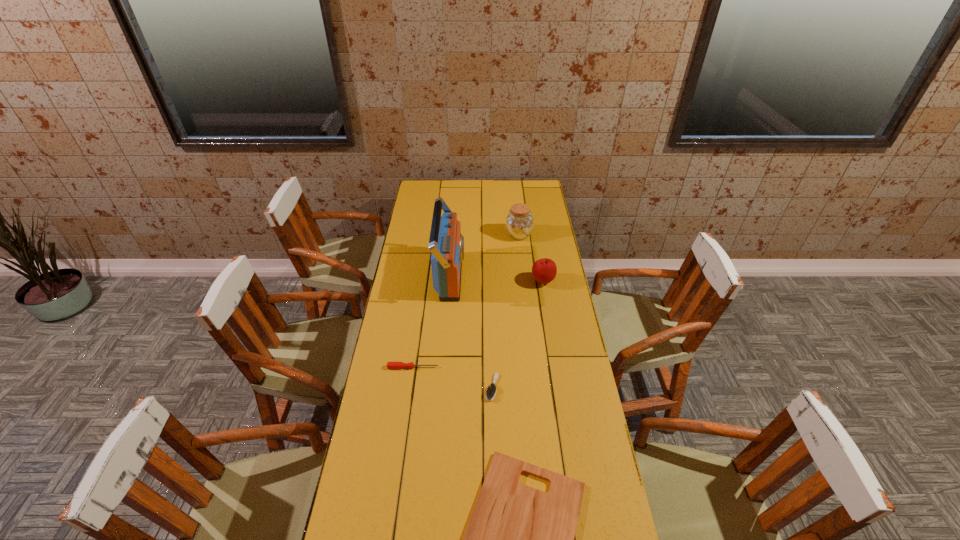
Image resolution: width=960 pixels, height=540 pixels. Identify the location of free point located 0.150m on the right of the scrubbing brush. [x=542, y=387].

Locate an element on the screen. Image resolution: width=960 pixels, height=540 pixels. object that is positioned at the left edge is located at coordinates (390, 365).

Find the location of a particular element. jar at the right edge is located at coordinates (519, 223).

The width and height of the screenshot is (960, 540). Find the location of `apple that is at the right edge`. apple that is at the right edge is located at coordinates (544, 270).

This screenshot has height=540, width=960. I want to click on free space at the far edge of the desktop, so 482,183.

The width and height of the screenshot is (960, 540). In order to click on vacant area at the left edge in this screenshot , I will do `click(420, 337)`.

This screenshot has width=960, height=540. In order to click on blank space at the right edge in this screenshot , I will do `click(539, 256)`.

The height and width of the screenshot is (540, 960). In order to click on vacant space at the far left corner of the desktop in this screenshot , I will do `click(428, 199)`.

I want to click on vacant area between the fifth shortest object and the fifth farthest object, so click(505, 311).

In order to click on vacant area that lies between the scrubbing brush and the radio receiver in this screenshot , I will do `click(471, 332)`.